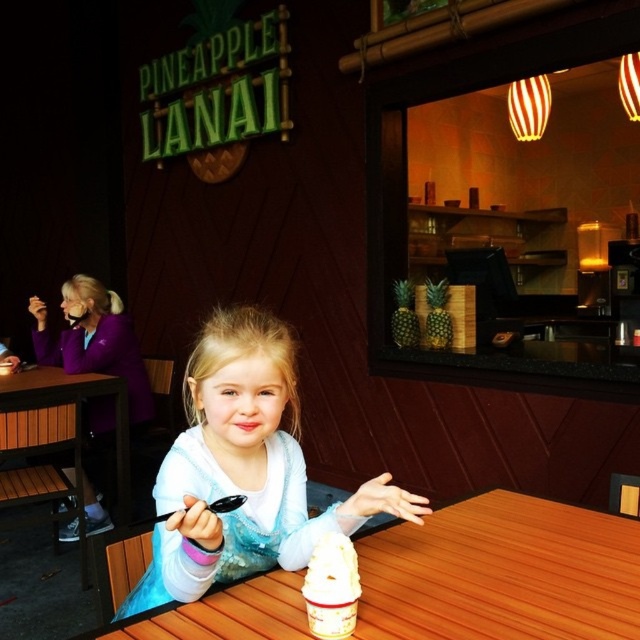
Can you confirm if wooden table at center is positioned below white satin dress at center?

Yes.

In order to click on wooden table at center in this screenshot , I will do `click(500, 573)`.

I want to click on wooden table at center, so click(500, 573).

The width and height of the screenshot is (640, 640). What do you see at coordinates (243, 468) in the screenshot?
I see `white satin dress at center` at bounding box center [243, 468].

Does white satin dress at center appear over brown wooden table at lower left?

Indeed, white satin dress at center is positioned over brown wooden table at lower left.

At what (x,y) coordinates should I click in order to perform the action: click on white satin dress at center. Please return your answer as a coordinate pair (x, y). This screenshot has width=640, height=640. Looking at the image, I should click on (243, 468).

From the picture: Between wooden table at center and white creamy ice cream at lower center, which one has less height?

wooden table at center

Identify the location of wooden table at center. This screenshot has width=640, height=640. (500, 573).